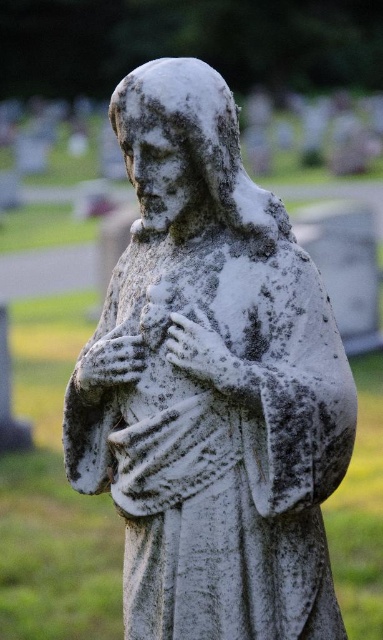
You are standing in a cemetery and want to place a bouquet of flowers at the base of the white marble statue at center. If your arm reaches 4 feet when fully extended, can you reach the statue without moving closer?

The white marble statue at center is 4.44 feet away from the viewer. Since your arm can only reach 4 feet when fully extended, you cannot reach the statue without moving closer.

You are an artist planning to create a miniature version of the scene. You need to ensure the proportions between the white marble statue at center and the white stone hand at center are accurate. Which object should be significantly larger in your model?

The white marble statue at center should be significantly larger in the model since it is much taller than the white stone hand at center.

You are a sculptor examining the white marble statue at center and the white stone hand at center in the image. Which object is larger in size?

The white marble statue at center is bigger than the white stone hand at center.